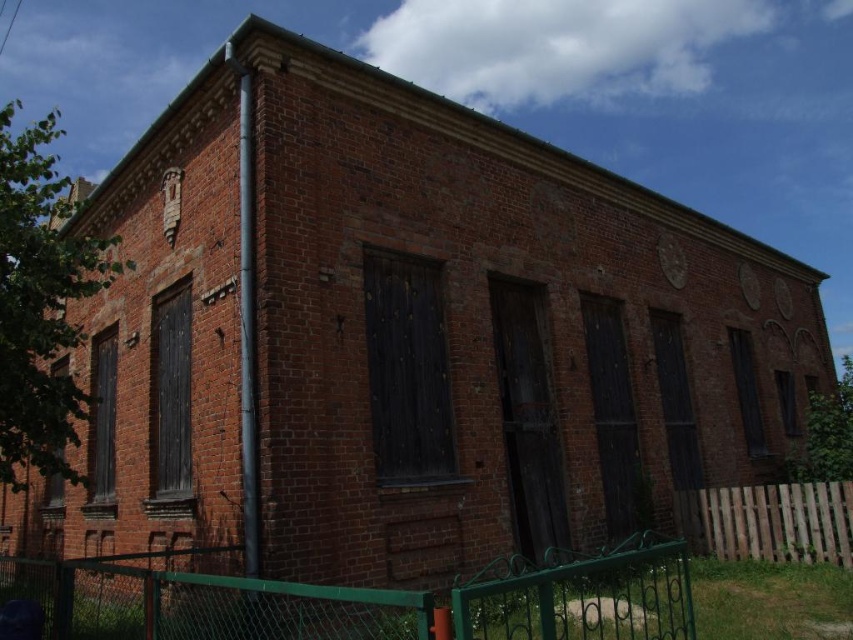
Consider the image. You are standing in front of the weathered brick building and notice two fences. The green metal fence at lower center and the brown wooden fence at lower right. Which fence takes up more space in the scene?

The brown wooden fence at lower right occupies more space than the green metal fence at lower center.